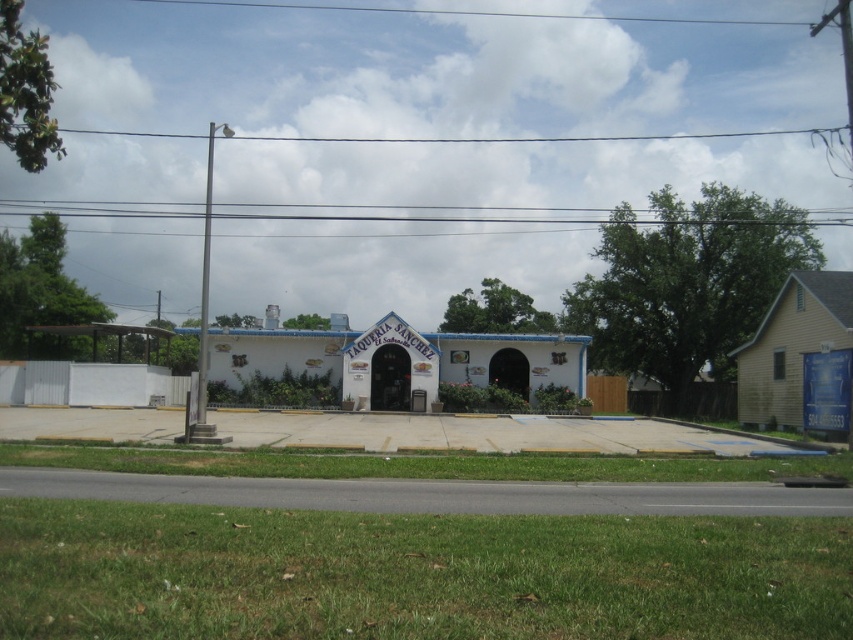
You are standing in front of the white stucco building at center and the yellow wood house at right. Which structure has a bigger footprint on the ground?

The white stucco building at center has a larger size compared to the yellow wood house at right, so it has a bigger footprint on the ground.

You are standing at the origin point of the coordinate system. You need to locate the white stucco building at center. What are its coordinates?

The white stucco building at center is located at coordinates point (390, 362).

You are standing in front of the white stucco building at center and want to walk to the yellow wood house at right. Which direction should you face to move towards it?

You should face towards the right direction because the yellow wood house at right is located to the right side of the white stucco building at center.